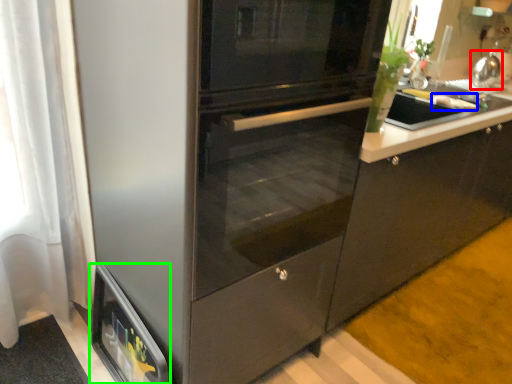
Question: Which object is positioned farthest from kitchen appliance (highlighted by a red box)? Select from food (highlighted by a blue box) and home appliance (highlighted by a green box).

Choices:
 (A) food
 (B) home appliance

Answer: (B)